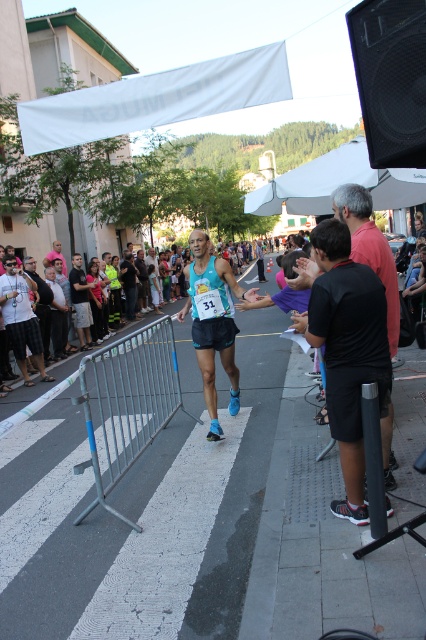
You are a photographer standing at the camera position. You want to take a photo of the finish line banner. There is an obstacle at point (x=359, y=413) that is 3.31 meters away from you. Can you move 3 meters forward to avoid it?

The obstacle at point (x=359, y=413) is 3.31 meters away from you. If you move 3 meters forward, you will still be 0.31 meters away from the obstacle, so you can safely take the photo without hitting the obstacle.

You are standing at the finish line of a marathon and want to place a medal on a pole located at point (238, 404). If the medal pole is 6 meters tall, will the medal reach the top?

The distance between you and the point (238, 404) is 6.02 meters. Since the medal pole is 6 meters tall, the medal will not reach the top as it is slightly shorter than the distance required.

You are a race official at the marathon finish line. You need to place a new banner exactly at the center of the silver metallic rail at center. Where should you position the banner in terms of coordinates?

The silver metallic rail at center is located at coordinates point (129, 401), so you should place the new banner exactly at those coordinates.